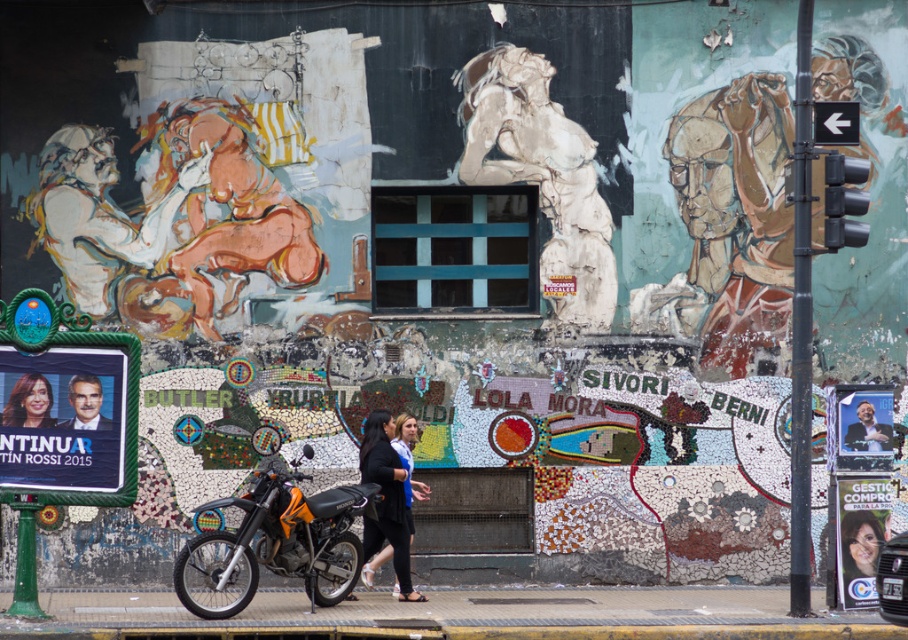
You are a photographer standing in front of the mural. You want to take a photo that includes both the orange matte motorcycle at center and the smooth skin face at center. Which object should you position closer to the camera to ensure both are in focus?

To ensure both the orange matte motorcycle at center and the smooth skin face at center are in focus, position the orange matte motorcycle at center closer to the camera since it is in front of the smooth skin face at center.

You are a delivery person who needs to park your motorcycle in a specific spot. The motorcycle must be placed exactly at the coordinates given in the scene description. Where should you position the orange matte motorcycle at center?

The orange matte motorcycle at center should be positioned at the coordinates point (273, 541) as specified in the scene description.

Looking at this image, you are a photographer standing in front of the mural. You want to capture the black leather jacket at center in your shot. What is the exact 2D coordinate where you should focus your camera?

The exact 2D coordinate for the black leather jacket at center is point (386, 499).